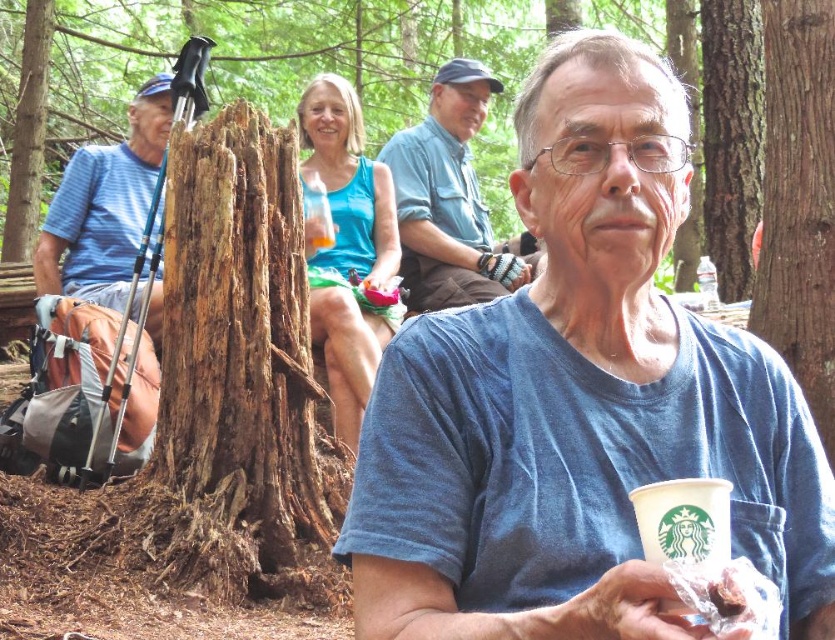
Looking at this image, does blue striped shirt at left appear under brown rough tree stump at left?

Yes.

Is point (99, 257) positioned before point (33, 138)?

Yes, it is in front of point (33, 138).

Is point (104, 240) closer to viewer compared to point (44, 54)?

Yes, it is.

Find the location of a particular element. The height and width of the screenshot is (640, 835). blue striped shirt at left is located at coordinates (105, 205).

Is blue fabric tank top at upper center to the left of brown rough tree stump at left from the viewer's perspective?

No, blue fabric tank top at upper center is not to the left of brown rough tree stump at left.

Is blue fabric tank top at upper center further to camera compared to brown rough tree stump at left?

No, blue fabric tank top at upper center is in front of brown rough tree stump at left.

The image size is (835, 640). In order to click on blue fabric tank top at upper center in this screenshot , I will do `click(348, 250)`.

Who is positioned more to the left, smooth bark tree at right or blue striped shirt at left?

From the viewer's perspective, blue striped shirt at left appears more on the left side.

Does smooth bark tree at right have a lesser width compared to blue striped shirt at left?

Correct, smooth bark tree at right's width is less than blue striped shirt at left's.

The height and width of the screenshot is (640, 835). Identify the location of smooth bark tree at right. (798, 200).